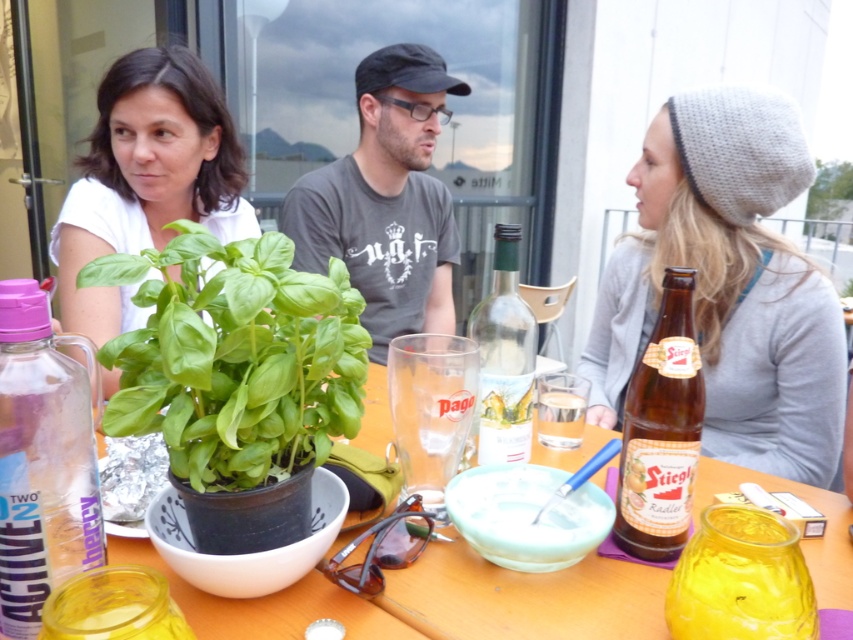
Question: Among these points, which one is nearest to the camera?

Choices:
 (A) (753, 220)
 (B) (712, 620)

Answer: (B)

Question: Does clear glass bottle at center have a larger size compared to clear glass at center?

Choices:
 (A) yes
 (B) no

Answer: (A)

Question: Is translucent glass jar at center thinner than clear glass bottle at center?

Choices:
 (A) no
 (B) yes

Answer: (A)

Question: Which point is closer to the camera taking this photo?

Choices:
 (A) (102, 525)
 (B) (618, 614)
 (C) (788, 301)

Answer: (A)

Question: Which object is closer to the camera taking this photo?

Choices:
 (A) knitted gray beanie at upper right
 (B) transparent plastic bottle at lower left
 (C) gray cotton t-shirt at center
 (D) wooden table at center

Answer: (B)

Question: Does translucent glass jar at center come in front of clear glass at center?

Choices:
 (A) yes
 (B) no

Answer: (A)